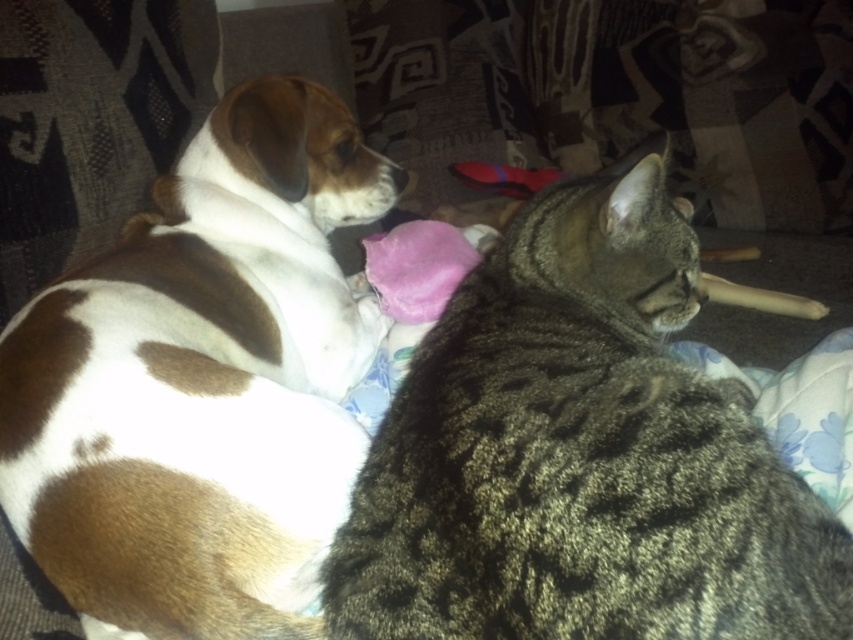
Question: Can you confirm if tabby fur cat at center is positioned to the right of brown and white fur dog at left?

Choices:
 (A) no
 (B) yes

Answer: (B)

Question: Which point is farther from the camera taking this photo?

Choices:
 (A) (74, 541)
 (B) (838, 545)

Answer: (B)

Question: Is tabby fur cat at center thinner than brown and white fur dog at left?

Choices:
 (A) yes
 (B) no

Answer: (B)

Question: Which object appears closest to the camera in this image?

Choices:
 (A) brown and white fur dog at left
 (B) tabby fur cat at center

Answer: (B)

Question: Is tabby fur cat at center to the right of brown and white fur dog at left from the viewer's perspective?

Choices:
 (A) yes
 (B) no

Answer: (A)